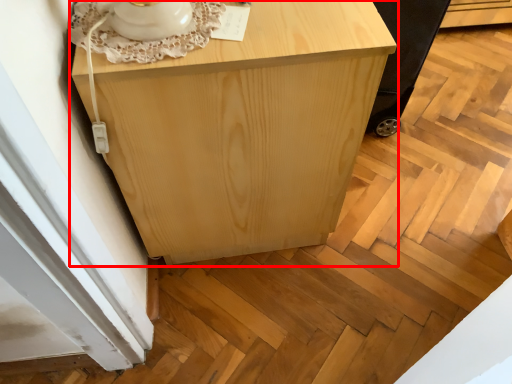
Question: From the image, what is the correct spatial relationship of furniture (annotated by the red box) in relation to baby carriage?

Choices:
 (A) right
 (B) left

Answer: (B)